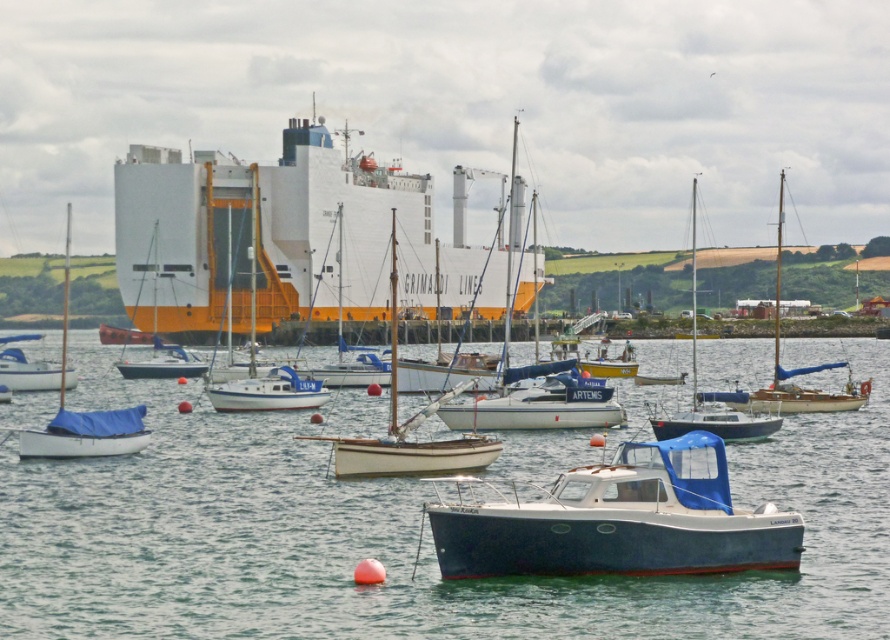
You are standing on the pier and want to walk to the point labeled point (x=476, y=316). However, there is an obstacle at point labeled point (x=164, y=426). Can you walk directly to your destination without going around the obstacle?

Point (x=164, y=426) is in front of point (x=476, y=316), so you cannot walk directly to point (x=476, y=316) without going around the obstacle at point (x=164, y=426).

Based on the photo, you are a harbor worker who needs to move the blue matte boat at center and the white matte sailboat at center. Based on their positions, which boat should you move first to avoid blocking the other?

The blue matte boat at center is to the right of the white matte sailboat at center. Since the blue boat is positioned to the right, moving the white matte sailboat at center first would prevent it from blocking access to the blue boat.

You are standing on the pier and see both the white matte cargo ship at center and the white matte sailboat at center. Which one appears closer to you?

The white matte cargo ship at center appears closer because it is further to the viewer than the white matte sailboat at center.